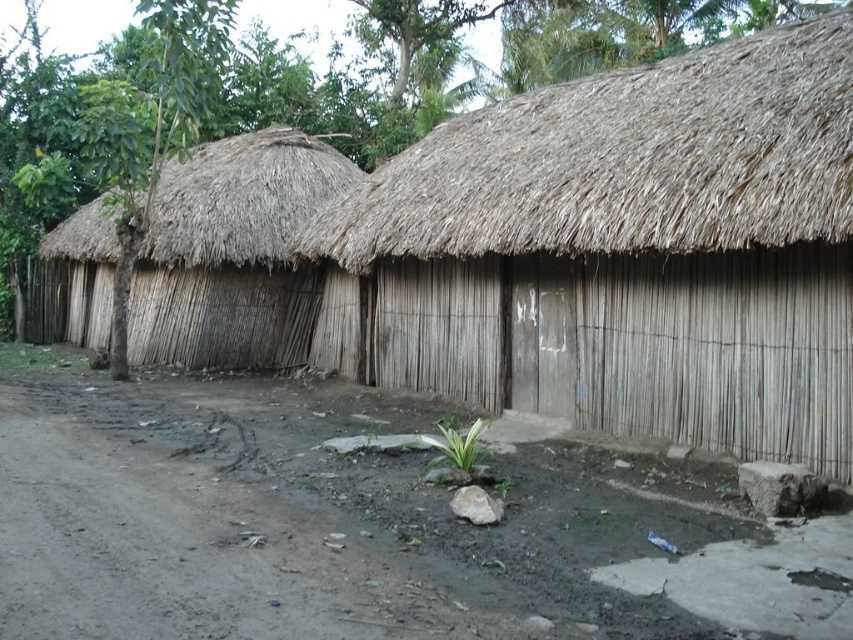
From the picture: Is brown dirt track at lower left to the left of natural straw hut at left from the viewer's perspective?

No, brown dirt track at lower left is not to the left of natural straw hut at left.

Is point (102, 570) in front of point (221, 237)?

Yes, point (102, 570) is in front of point (221, 237).

Is point (645, 534) closer to camera compared to point (158, 294)?

Yes, point (645, 534) is in front of point (158, 294).

Image resolution: width=853 pixels, height=640 pixels. Find the location of `brown dirt track at lower left`. brown dirt track at lower left is located at coordinates (318, 536).

Can you confirm if brown thatch roof at upper center is positioned to the right of natural straw hut at left?

Indeed, brown thatch roof at upper center is positioned on the right side of natural straw hut at left.

The width and height of the screenshot is (853, 640). Find the location of `brown thatch roof at upper center`. brown thatch roof at upper center is located at coordinates (625, 161).

Locate an element on the screen. The height and width of the screenshot is (640, 853). brown thatch roof at upper center is located at coordinates (625, 161).

Which is in front, point (128, 408) or point (695, 196)?

Positioned in front is point (695, 196).

Does brown dirt track at lower left have a greater width compared to brown thatch roof at upper center?

Yes, brown dirt track at lower left is wider than brown thatch roof at upper center.

Does point (521, 584) come in front of point (666, 102)?

Yes, point (521, 584) is closer to viewer.

Find the location of a particular element. brown dirt track at lower left is located at coordinates (318, 536).